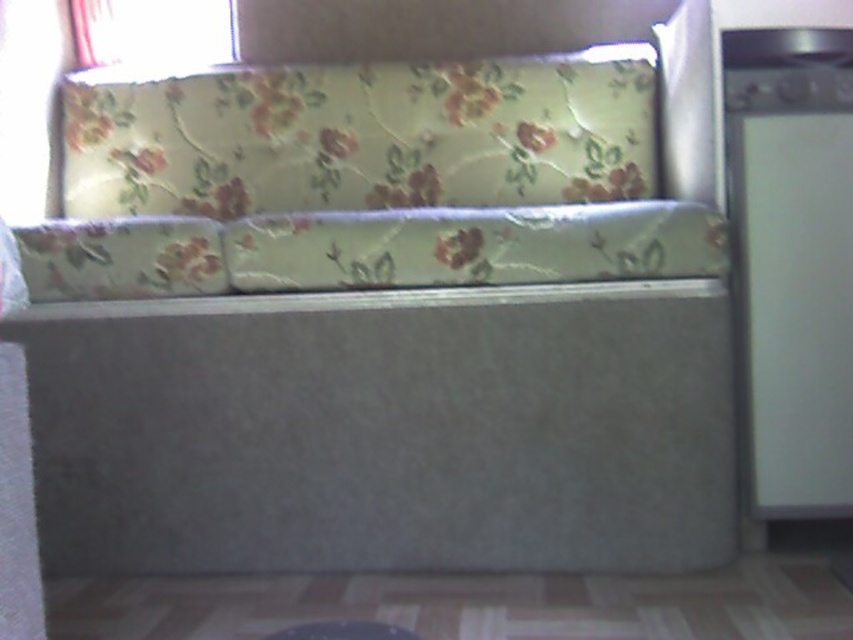
Question: Is floral fabric pillow at center positioned at the back of white sheer curtain at upper left?

Choices:
 (A) yes
 (B) no

Answer: (B)

Question: Is floral fabric pillow at center bigger than white sheer curtain at upper left?

Choices:
 (A) yes
 (B) no

Answer: (A)

Question: In this image, where is floral fabric pillow at center located relative to white sheer curtain at upper left?

Choices:
 (A) left
 (B) right

Answer: (B)

Question: Which of these objects is positioned farthest from the white matte refrigerator at right?

Choices:
 (A) white sheer curtain at upper left
 (B) floral fabric pillow at center

Answer: (A)

Question: Which of the following is the closest to the observer?

Choices:
 (A) white sheer curtain at upper left
 (B) white matte refrigerator at right

Answer: (B)

Question: Which point is closer to the camera taking this photo?

Choices:
 (A) (656, 253)
 (B) (795, 509)

Answer: (A)